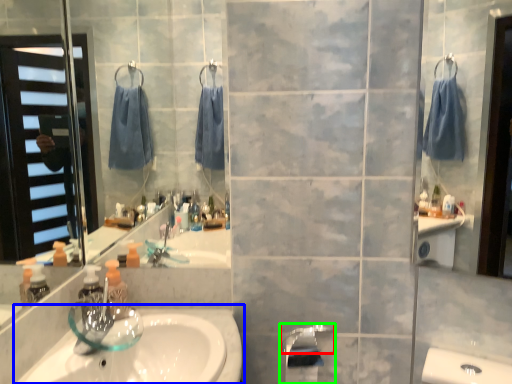
Question: Which is farther away from faucet (highlighted by a red box)? sink (highlighted by a blue box) or tap (highlighted by a green box)?

Choices:
 (A) sink
 (B) tap

Answer: (A)